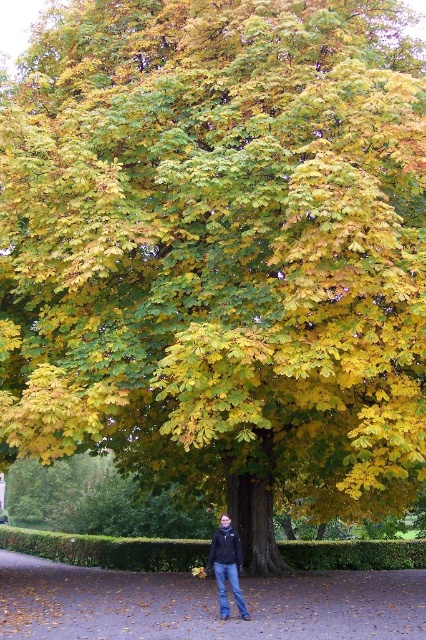
Question: Is brown dirt path at center to the left of dark blue jeans at center from the viewer's perspective?

Choices:
 (A) no
 (B) yes

Answer: (B)

Question: Does brown dirt path at center appear on the left side of dark blue jeans at center?

Choices:
 (A) no
 (B) yes

Answer: (B)

Question: Is brown dirt path at center smaller than dark blue jeans at center?

Choices:
 (A) no
 (B) yes

Answer: (A)

Question: Which object is farther from the camera taking this photo?

Choices:
 (A) brown dirt path at center
 (B) dark blue jeans at center

Answer: (B)

Question: Which point is farther to the camera?

Choices:
 (A) dark blue jeans at center
 (B) brown dirt path at center

Answer: (A)